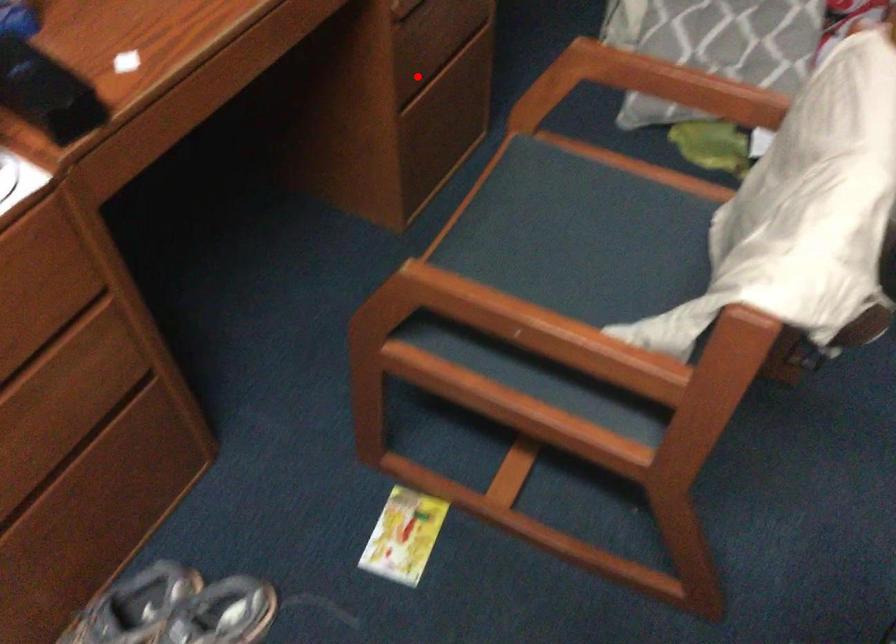
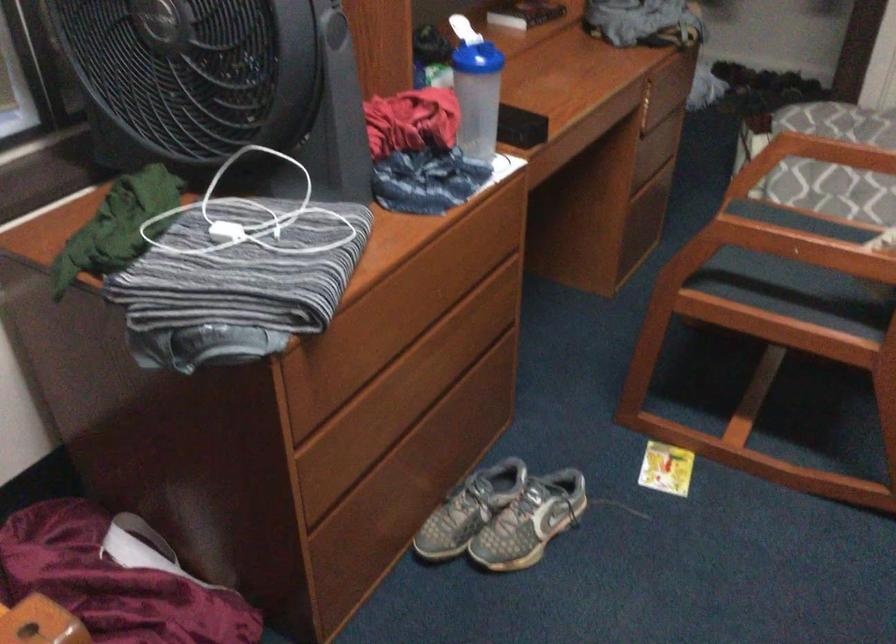
The point at the highlighted location is marked in the first image. Where is the corresponding point in the second image?

(643, 169)